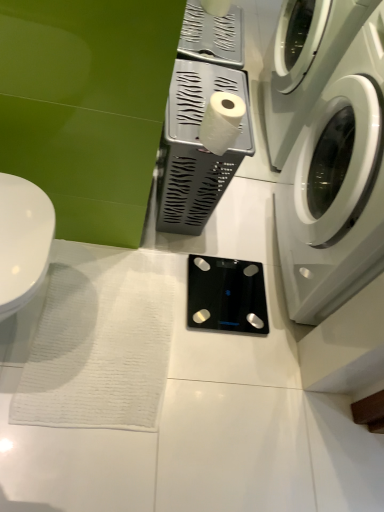
Question: Would you say black glass scale at center, which is the first appliance in bottom-to-top order, is part of white matte toilet paper at center's contents?

Choices:
 (A) yes
 (B) no

Answer: (B)

Question: From the image's perspective, is white matte toilet paper at center under black glass scale at center, which is the first appliance in bottom-to-top order?

Choices:
 (A) no
 (B) yes

Answer: (A)

Question: Could you tell me if white matte toilet paper at center is facing black glass scale at center, acting as the 2th appliance starting from the top?

Choices:
 (A) yes
 (B) no

Answer: (B)

Question: Is white matte toilet paper at center behind black glass scale at center, which is the first appliance in bottom-to-top order?

Choices:
 (A) yes
 (B) no

Answer: (B)

Question: Is black glass scale at center, acting as the 2th appliance starting from the top, at the back of white matte toilet paper at center?

Choices:
 (A) yes
 (B) no

Answer: (B)

Question: Is white glossy toilet at left spatially inside white plastic tissue holder at center, which appears as the 2th appliance when ordered from the bottom, or outside of it?

Choices:
 (A) inside
 (B) outside

Answer: (B)

Question: From the image's perspective, relative to white plastic tissue holder at center, which appears as the 2th appliance when ordered from the bottom, is white glossy toilet at left above or below?

Choices:
 (A) above
 (B) below

Answer: (B)

Question: From a real-world perspective, relative to white plastic tissue holder at center, placed as the first appliance when sorted from top to bottom, is white glossy toilet at left vertically above or below?

Choices:
 (A) below
 (B) above

Answer: (B)

Question: Is white glossy toilet at left in front of or behind white plastic tissue holder at center, which appears as the 2th appliance when ordered from the bottom, in the image?

Choices:
 (A) behind
 (B) front

Answer: (B)

Question: From the image's perspective, is white glossy washing machine at right positioned above or below white matte toilet paper at center?

Choices:
 (A) below
 (B) above

Answer: (A)

Question: In terms of width, does white glossy washing machine at right look wider or thinner when compared to white matte toilet paper at center?

Choices:
 (A) wide
 (B) thin

Answer: (A)

Question: In terms of height, does white glossy washing machine at right look taller or shorter compared to white matte toilet paper at center?

Choices:
 (A) tall
 (B) short

Answer: (A)

Question: Visually, is white glossy washing machine at right positioned to the left or to the right of white matte toilet paper at center?

Choices:
 (A) left
 (B) right

Answer: (B)

Question: Looking at the image, does white plastic tissue holder at center, which appears as the 2th appliance when ordered from the bottom, seem bigger or smaller compared to white glossy washing machine at right?

Choices:
 (A) small
 (B) big

Answer: (A)

Question: Considering the relative positions of white plastic tissue holder at center, placed as the first appliance when sorted from top to bottom, and white glossy washing machine at right in the image provided, is white plastic tissue holder at center, placed as the first appliance when sorted from top to bottom, to the left or to the right of white glossy washing machine at right?

Choices:
 (A) left
 (B) right

Answer: (A)